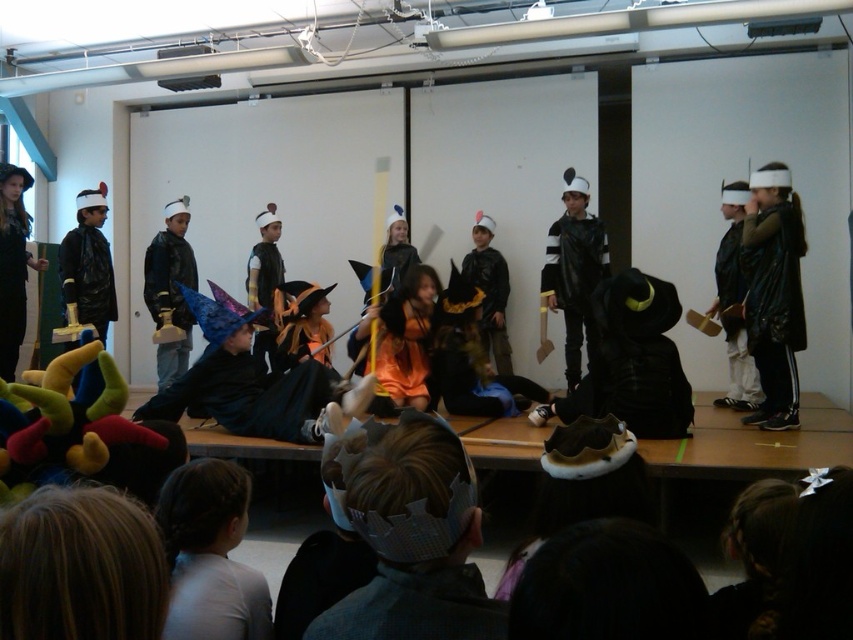
Does orange matte dress at center have a lesser height compared to black matte cape at right?

Correct, orange matte dress at center is not as tall as black matte cape at right.

Can you confirm if orange matte dress at center is taller than black matte cape at right?

No.

Which is in front, point (381, 310) or point (733, 388)?

Point (381, 310) is more forward.

Locate an element on the screen. The height and width of the screenshot is (640, 853). orange matte dress at center is located at coordinates click(x=398, y=349).

Between shiny black cape at center and matte black wizard hat at left, which one is positioned higher?

matte black wizard hat at left

Is shiny black cape at center wider than matte black wizard hat at left?

Indeed, shiny black cape at center has a greater width compared to matte black wizard hat at left.

Find the location of a particular element. The width and height of the screenshot is (853, 640). shiny black cape at center is located at coordinates (573, 278).

The height and width of the screenshot is (640, 853). I want to click on shiny black cape at center, so click(x=573, y=278).

Which is above, black leather cape at right or orange matte dress at center?

Positioned higher is black leather cape at right.

Is black leather cape at right below orange matte dress at center?

No, black leather cape at right is not below orange matte dress at center.

Where is `black leather cape at right`? Image resolution: width=853 pixels, height=640 pixels. black leather cape at right is located at coordinates (773, 301).

This screenshot has width=853, height=640. Find the location of `black leather cape at right`. black leather cape at right is located at coordinates pos(773,301).